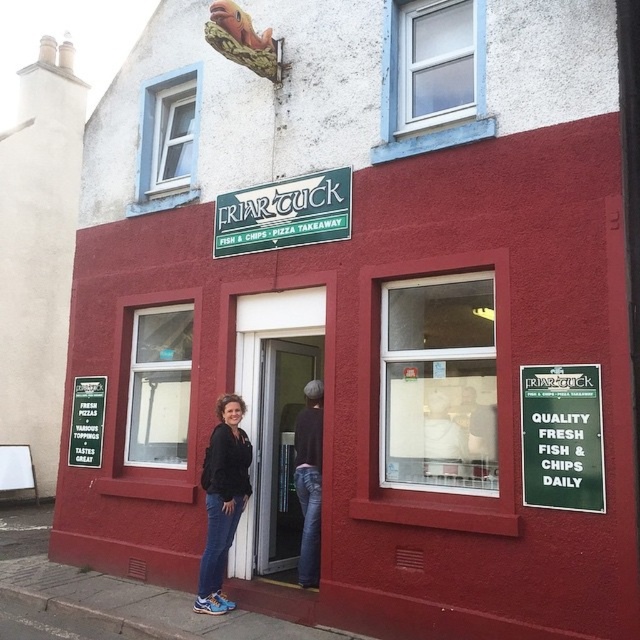
You are a customer looking at the Friar Tuck shop. You notice the green matte signboard at center right and the matte black jacket at center. Which object takes up more visual space in the scene?

The matte black jacket at center takes up more visual space than the green matte signboard at center right because the signboard occupies less space according to the description.

You are a customer looking at the Friar Tuck shop. You see two green signs. The first is the green matte signboard at center right, and the second is the green plastic signboard at center. Which sign is positioned higher up?

The green matte signboard at center right is located above the green plastic signboard at center, so it is positioned higher up.

You are a delivery person approaching the Friar Tuck shop. You need to pick up a jacket left by a customer. The jacket is located at the center of the shop exterior. However, there is a green matte sign at upper center that might block your view. Can you see the matte black jacket at center from your current position outside the shop?

The green matte sign at upper center is further to the viewer than the matte black jacket at center, so the sign is closer to you and may block your view of the jacket behind it. You might need to move to the side to see or access the matte black jacket at center.